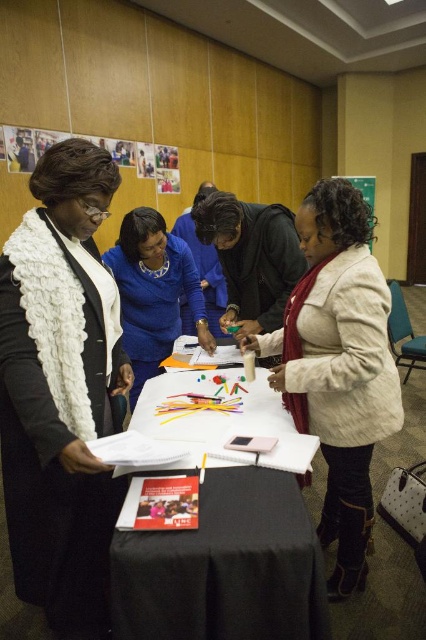
Between point (103, 520) and point (117, 608), which one is positioned in front?

Point (117, 608) is more forward.

Can you confirm if white fluffy scarf at upper left is shorter than white paper at center?

No, white fluffy scarf at upper left is not shorter than white paper at center.

You are a GUI agent. You are given a task and a screenshot of the screen. Output one action in this format:
    pyautogui.click(x=<x>, y=<y>)
    Task: Click on the white fluffy scarf at upper left
    
    Given the screenshot: What is the action you would take?
    pyautogui.click(x=60, y=388)

Image resolution: width=426 pixels, height=640 pixels. Identify the location of white fluffy scarf at upper left. pos(60,388).

Is matte black jacket at center taller than green matte bulletin board at upper center?

Incorrect, matte black jacket at center's height is not larger of green matte bulletin board at upper center's.

Measure the distance between point (233, 314) and camera.

Point (233, 314) is 2.37 meters from camera.

Does point (233, 244) lie behind point (353, 180)?

No, it is not.

I want to click on matte black jacket at center, so click(252, 259).

What do you see at coordinates (154, 292) in the screenshot? I see `blue fabric shirt at center` at bounding box center [154, 292].

Measure the distance between blue fabric shirt at center and matte black jacket at center.

blue fabric shirt at center and matte black jacket at center are 11.17 inches apart from each other.

Between point (137, 264) and point (276, 324), which one is positioned in front?

Point (137, 264) is in front.

Find the location of a particular element. This screenshot has height=640, width=426. blue fabric shirt at center is located at coordinates (154, 292).